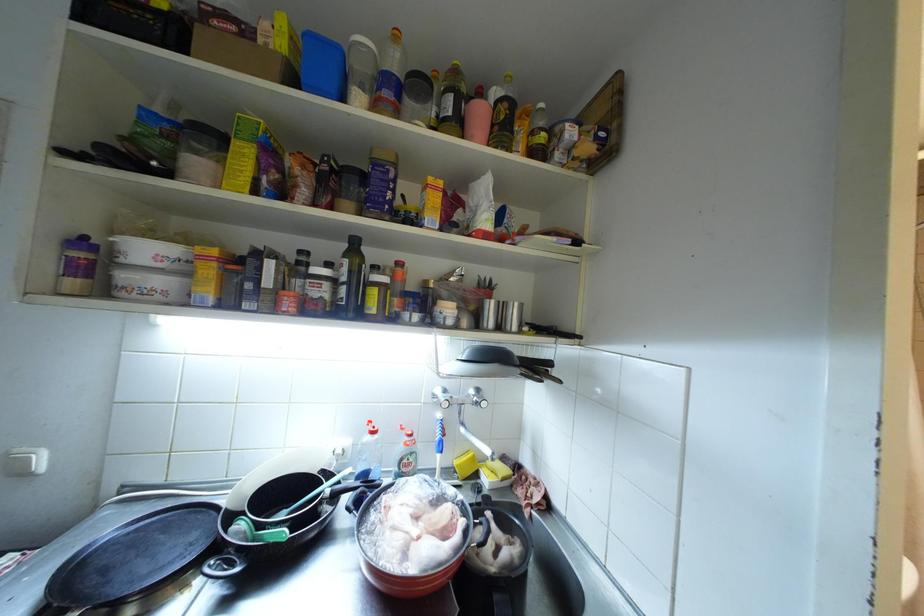
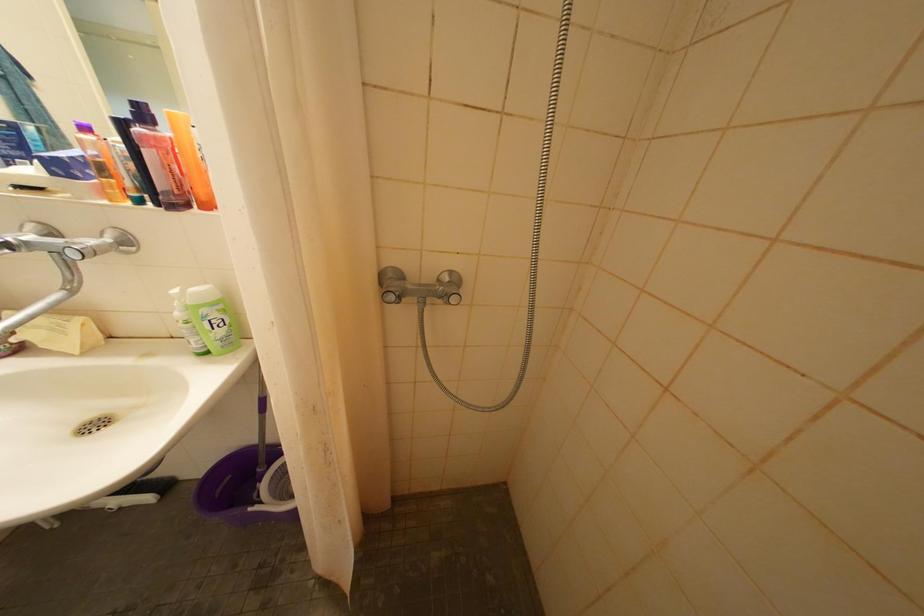
Question: Which direction would the cameraman need to move to produce the second image? Reply with the corresponding letter.

Choices:
 (A) Left
 (B) Right
 (C) Forward
 (D) Backward

Answer: (B)